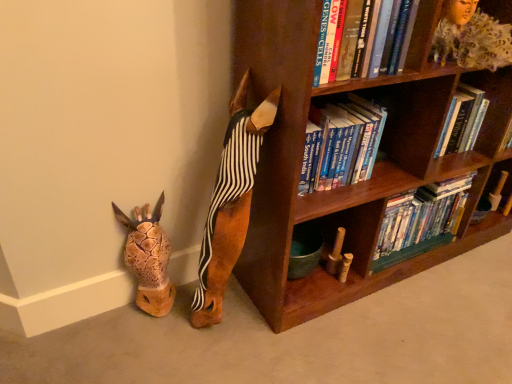
Question: Can you confirm if wooden bookshelf at upper right is wider than brown wooden dog at center, placed as the first animal when sorted from right to left?

Choices:
 (A) yes
 (B) no

Answer: (A)

Question: Is wooden bookshelf at upper right next to brown wooden dog at center, which appears as the 2th animal when viewed from the left?

Choices:
 (A) yes
 (B) no

Answer: (B)

Question: Is wooden bookshelf at upper right further to the viewer compared to brown wooden dog at center, placed as the first animal when sorted from right to left?

Choices:
 (A) yes
 (B) no

Answer: (A)

Question: Can brown wooden dog at center, placed as the first animal when sorted from right to left, be found inside wooden bookshelf at upper right?

Choices:
 (A) no
 (B) yes

Answer: (A)

Question: Is wooden bookshelf at upper right positioned far away from brown wooden dog at center, which appears as the 2th animal when viewed from the left?

Choices:
 (A) yes
 (B) no

Answer: (B)

Question: Considering the relative sizes of wooden bookshelf at upper right and brown wooden dog at center, placed as the first animal when sorted from right to left, in the image provided, is wooden bookshelf at upper right shorter than brown wooden dog at center, placed as the first animal when sorted from right to left,?

Choices:
 (A) yes
 (B) no

Answer: (A)

Question: Considering the relative sizes of hardcover books at center, the 1th book from the back, and wooden bookshelf at upper right in the image provided, is hardcover books at center, the 1th book from the back, bigger than wooden bookshelf at upper right?

Choices:
 (A) yes
 (B) no

Answer: (A)

Question: Considering the relative sizes of hardcover books at center, the 1th book from the back, and wooden bookshelf at upper right in the image provided, is hardcover books at center, the 1th book from the back, taller than wooden bookshelf at upper right?

Choices:
 (A) no
 (B) yes

Answer: (B)

Question: Can we say hardcover books at center, which ranks as the 2th book in top-to-bottom order, lies outside wooden bookshelf at upper right?

Choices:
 (A) yes
 (B) no

Answer: (A)

Question: From the image's perspective, would you say hardcover books at center, positioned as the first book in bottom-to-top order, is shown under wooden bookshelf at upper right?

Choices:
 (A) yes
 (B) no

Answer: (A)

Question: Can you confirm if hardcover books at center, the 1th book from the back, is smaller than wooden bookshelf at upper right?

Choices:
 (A) no
 (B) yes

Answer: (A)

Question: Would you say wooden bookshelf at upper right is part of hardcover books at center, positioned as the first book in bottom-to-top order,'s contents?

Choices:
 (A) yes
 (B) no

Answer: (B)

Question: Considering the relative positions of brown wooden bookcase at upper right and wooden bookshelf at upper right in the image provided, is brown wooden bookcase at upper right in front of wooden bookshelf at upper right?

Choices:
 (A) yes
 (B) no

Answer: (A)